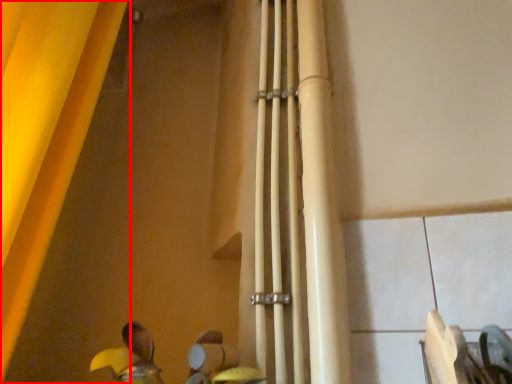
Question: From the image's perspective, where is curtain (annotated by the red box) located in relation to beam in the image?

Choices:
 (A) below
 (B) above

Answer: (B)